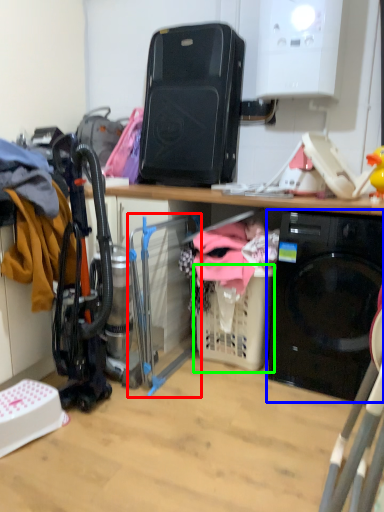
Question: Which object is the farthest from appliance (highlighted by a red box)? Choose among these: home appliance (highlighted by a blue box) or basket (highlighted by a green box).

Choices:
 (A) home appliance
 (B) basket

Answer: (A)